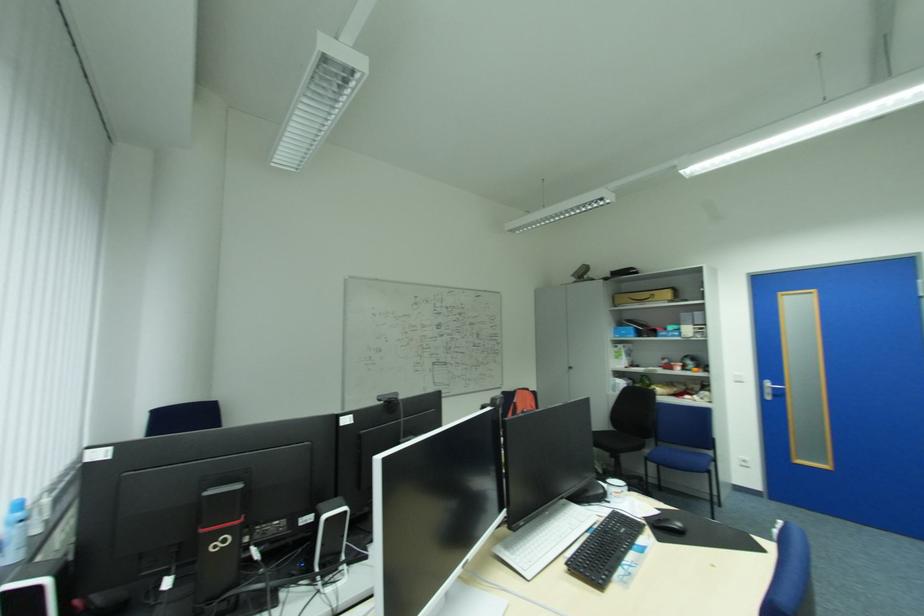
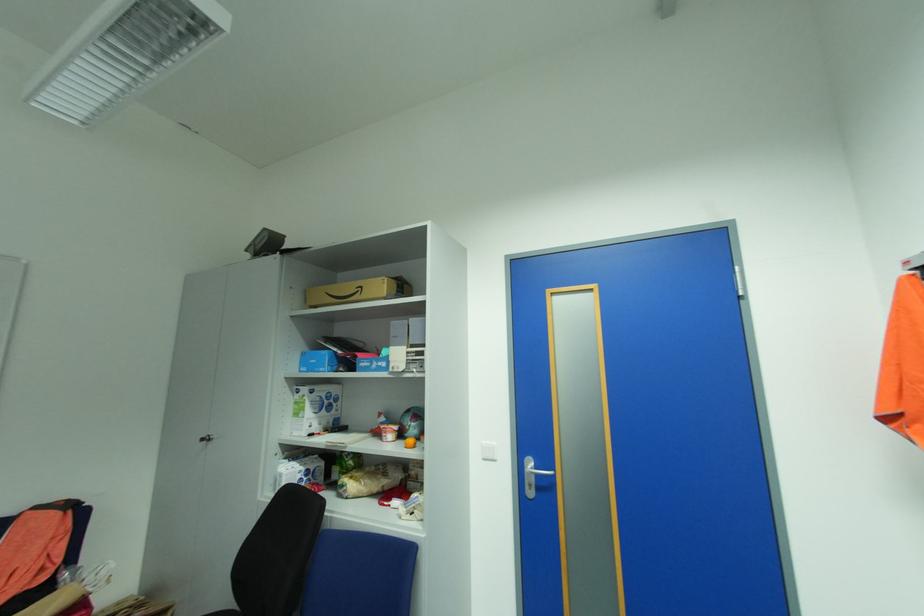
Find the pixel in the second image that matches (659,294) in the first image.

(368, 286)